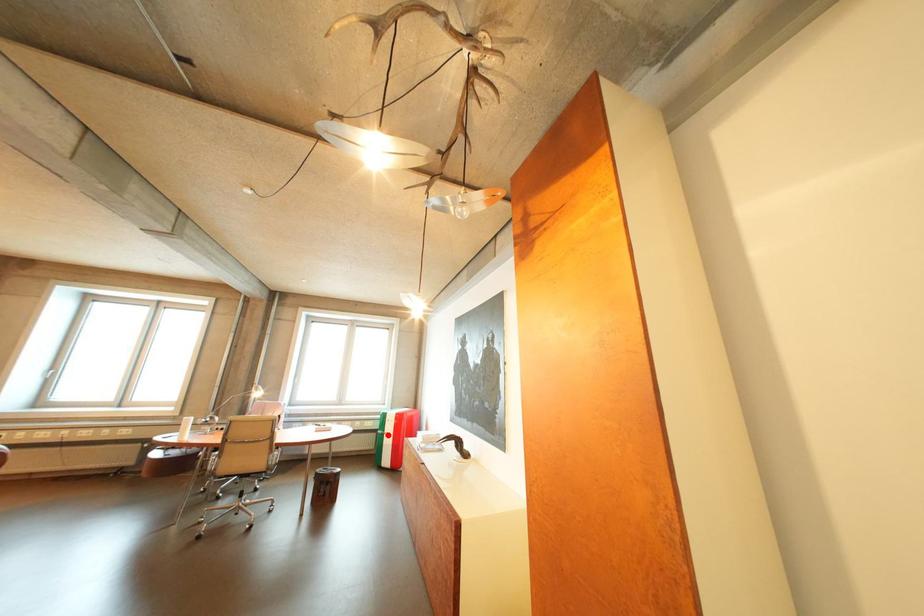
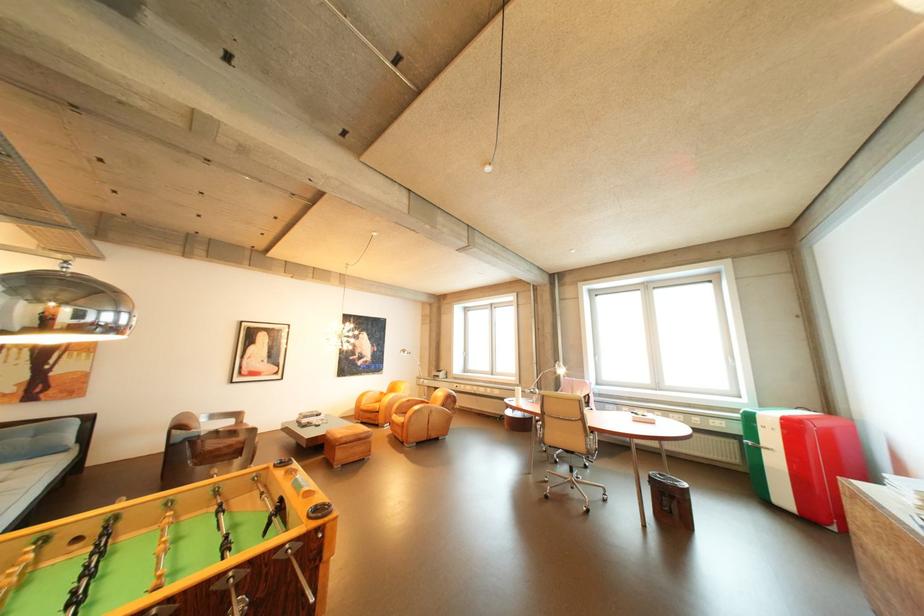
Question: I am providing you with two images of the same scene from different viewpoints. Image1 has a red point marked. In image2, the corresponding 3D location appears at what relative position? Reply with the corresponding letter.

Choices:
 (A) Closer
 (B) Farther

Answer: (A)